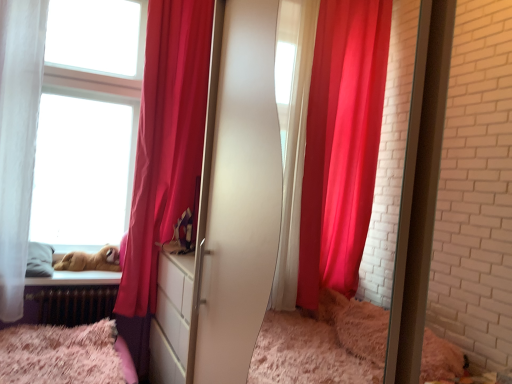
Question: From a real-world perspective, is fluffy pink bed at lower left located beneath silky red curtain at left?

Choices:
 (A) yes
 (B) no

Answer: (A)

Question: Considering the relative sizes of fluffy pink bed at lower left and silky red curtain at left in the image provided, is fluffy pink bed at lower left bigger than silky red curtain at left?

Choices:
 (A) yes
 (B) no

Answer: (B)

Question: From the image's perspective, is fluffy pink bed at lower left beneath silky red curtain at left?

Choices:
 (A) no
 (B) yes

Answer: (B)

Question: From a real-world perspective, is fluffy pink bed at lower left positioned over silky red curtain at left based on gravity?

Choices:
 (A) no
 (B) yes

Answer: (A)

Question: From the image's perspective, is fluffy pink bed at lower left on top of silky red curtain at left?

Choices:
 (A) no
 (B) yes

Answer: (A)

Question: In terms of size, does fluffy pink bed at lower left appear bigger or smaller than silky red curtain at left?

Choices:
 (A) small
 (B) big

Answer: (A)

Question: Would you say fluffy pink bed at lower left is to the left or to the right of silky red curtain at left in the picture?

Choices:
 (A) left
 (B) right

Answer: (A)

Question: From a real-world perspective, is fluffy pink bed at lower left physically located above or below silky red curtain at left?

Choices:
 (A) below
 (B) above

Answer: (A)

Question: In terms of height, does fluffy pink bed at lower left look taller or shorter compared to silky red curtain at left?

Choices:
 (A) tall
 (B) short

Answer: (B)

Question: In the image, is silky red curtain at left on the left side or the right side of brown plush toy at lower left?

Choices:
 (A) left
 (B) right

Answer: (B)

Question: Choose the correct answer: Is silky red curtain at left inside brown plush toy at lower left or outside it?

Choices:
 (A) outside
 (B) inside

Answer: (A)

Question: Based on their sizes in the image, would you say silky red curtain at left is bigger or smaller than brown plush toy at lower left?

Choices:
 (A) big
 (B) small

Answer: (A)

Question: From a real-world perspective, is silky red curtain at left physically located above or below brown plush toy at lower left?

Choices:
 (A) above
 (B) below

Answer: (A)

Question: Is silky red curtain at left spatially inside fluffy pink bed at lower left, or outside of it?

Choices:
 (A) outside
 (B) inside

Answer: (A)

Question: Looking at their shapes, would you say silky red curtain at left is wider or thinner than fluffy pink bed at lower left?

Choices:
 (A) thin
 (B) wide

Answer: (B)